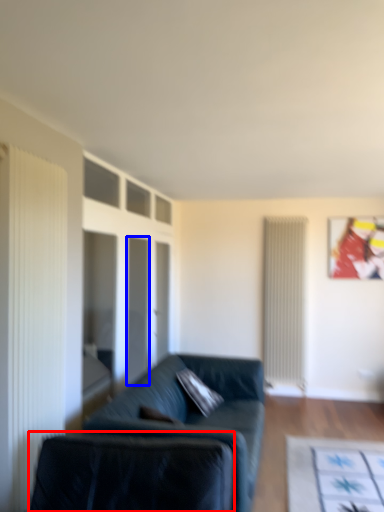
Question: Which of the following is the farthest to the observer, swivel chair (highlighted by a red box) or glass door (highlighted by a blue box)?

Choices:
 (A) swivel chair
 (B) glass door

Answer: (B)